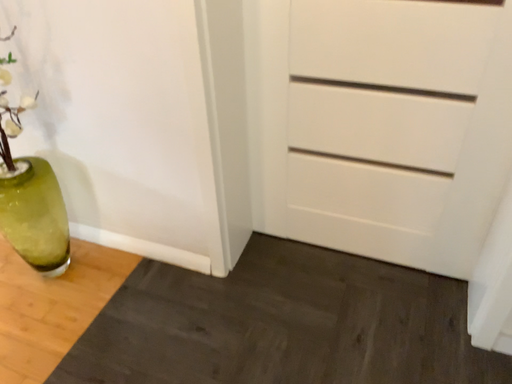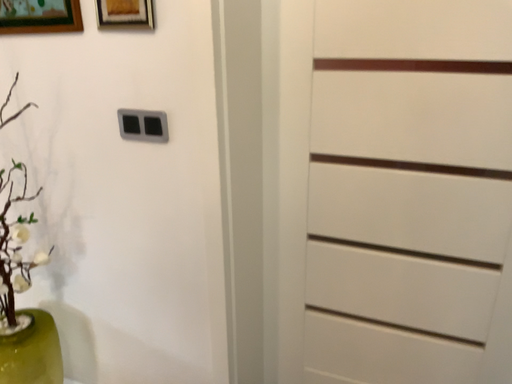
Question: How did the camera likely rotate when shooting the video?

Choices:
 (A) rotated downward
 (B) rotated upward

Answer: (B)